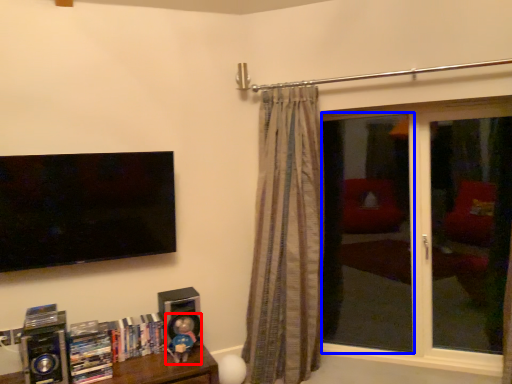
Question: Which point is further to the camera, toy (highlighted by a red box) or screen door (highlighted by a blue box)?

Choices:
 (A) toy
 (B) screen door

Answer: (B)